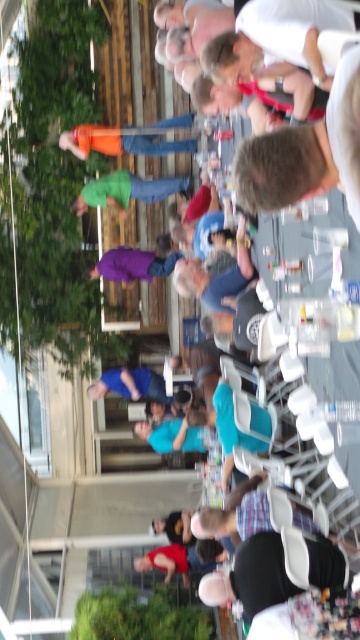
You are at the gathering and want to greet the person wearing the gray fabric shirt at upper center and the purple fabric pants at center. Which clothing item is closer to you?

The gray fabric shirt at upper center is closer to you than the purple fabric pants at center.

In the scene shown: You are a photographer at the event and want to capture both the gray fabric shirt at upper center and the black fabric shirt at lower center in a single frame. Which shirt should you focus on to ensure both are in the frame without moving the camera?

You should focus on the gray fabric shirt at upper center because it is much taller than the black fabric shirt at lower center, so keeping it centered will likely include both in the frame.